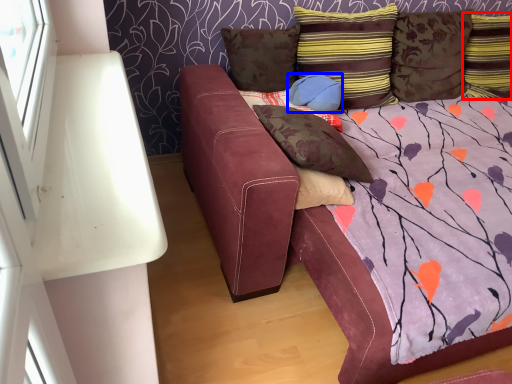
Question: Among these objects, which one is farthest to the camera, pillow (highlighted by a red box) or pillow (highlighted by a blue box)?

Choices:
 (A) pillow
 (B) pillow

Answer: (A)